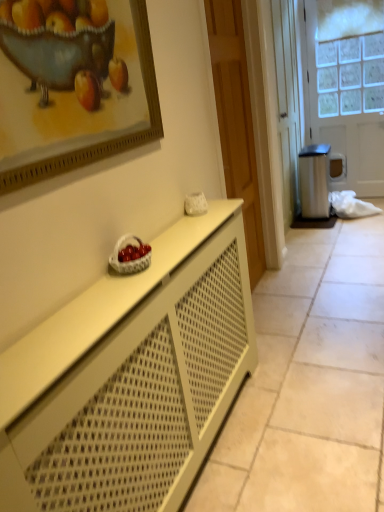
Identify the location of vacant space underneath wooden framed painting at upper left (from a real-world perspective). point(106,265).